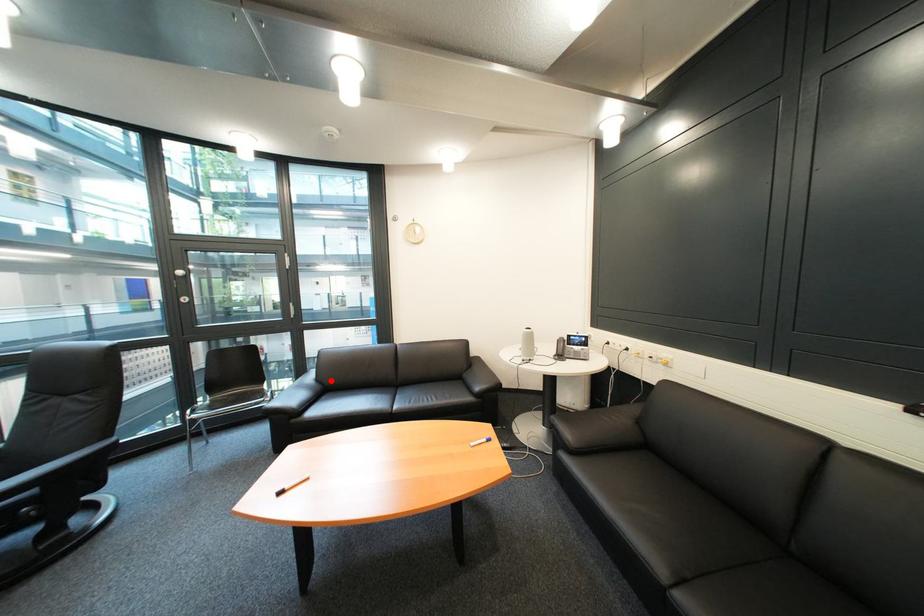
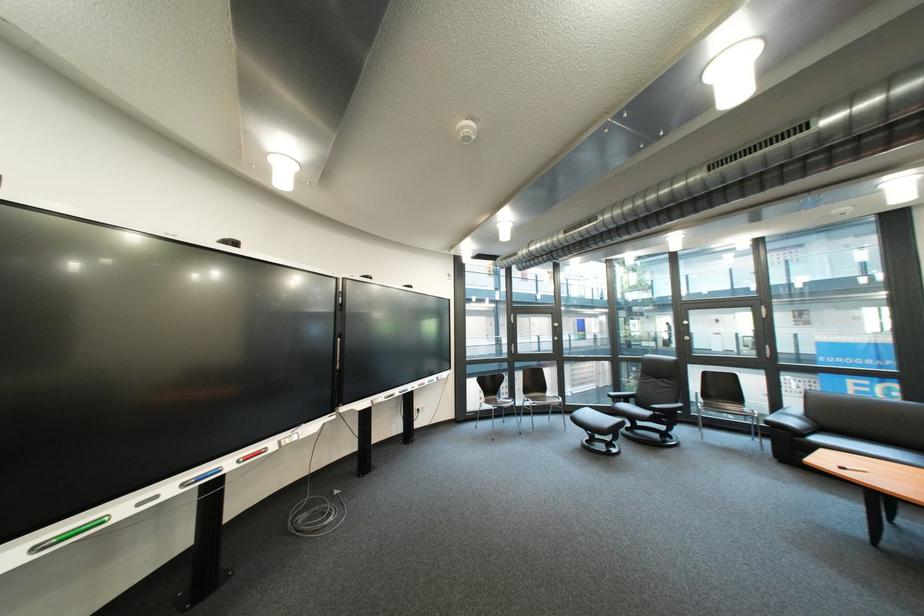
Question: I am providing you with two images of the same scene from different viewpoints. A red point is shown in image1. For the corresponding object point in image2, is it positioned nearer or farther from the camera?

Choices:
 (A) Nearer
 (B) Farther

Answer: (A)